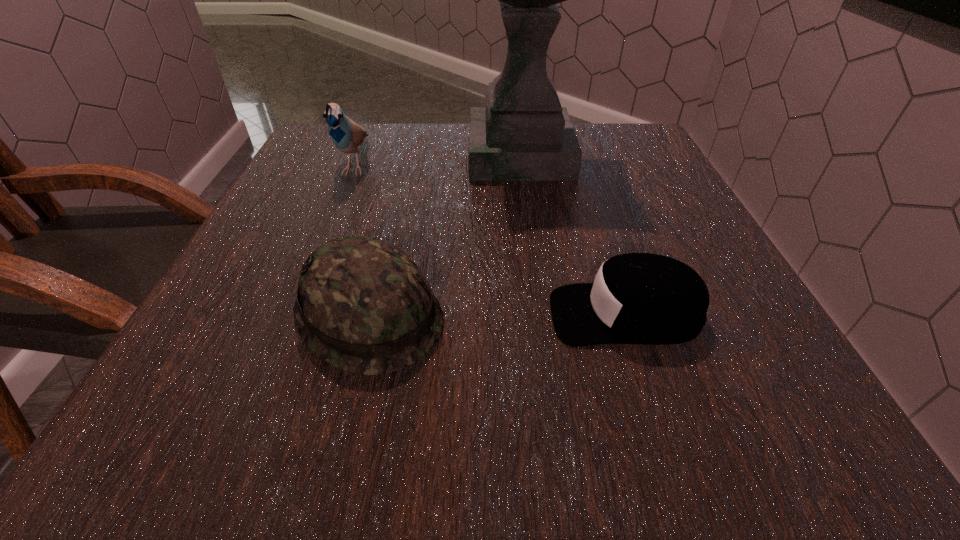
Where is `sculpture`? sculpture is located at coordinates (522, 134).

You are a GUI agent. You are given a task and a screenshot of the screen. Output one action in this format:
    pyautogui.click(x=<x>, y=<y>)
    Task: Click on the second tallest object
    The height and width of the screenshot is (540, 960).
    Given the screenshot: What is the action you would take?
    pyautogui.click(x=347, y=135)

This screenshot has width=960, height=540. I want to click on the third tallest object, so click(364, 306).

Identify the location of the taller cap. (364, 306).

Locate an element on the screen. This screenshot has width=960, height=540. the right cap is located at coordinates (637, 298).

Locate an element on the screen. The width and height of the screenshot is (960, 540). the shorter cap is located at coordinates (637, 298).

Identify the location of blank space located 0.330m at the front opening of the tallest object. 324,154.

Locate an element on the screen. This screenshot has height=540, width=960. vacant space located 0.380m at the front opening of the tallest object is located at coordinates (303, 154).

The image size is (960, 540). What are the coordinates of `free space located at the front opening of the tallest object` in the screenshot? It's located at (365, 154).

You are a GUI agent. You are given a task and a screenshot of the screen. Output one action in this format:
    pyautogui.click(x=<x>, y=<y>)
    Task: Click on the free space located 0.340m at the face of the second tallest object
    
    Given the screenshot: What is the action you would take?
    pyautogui.click(x=292, y=320)